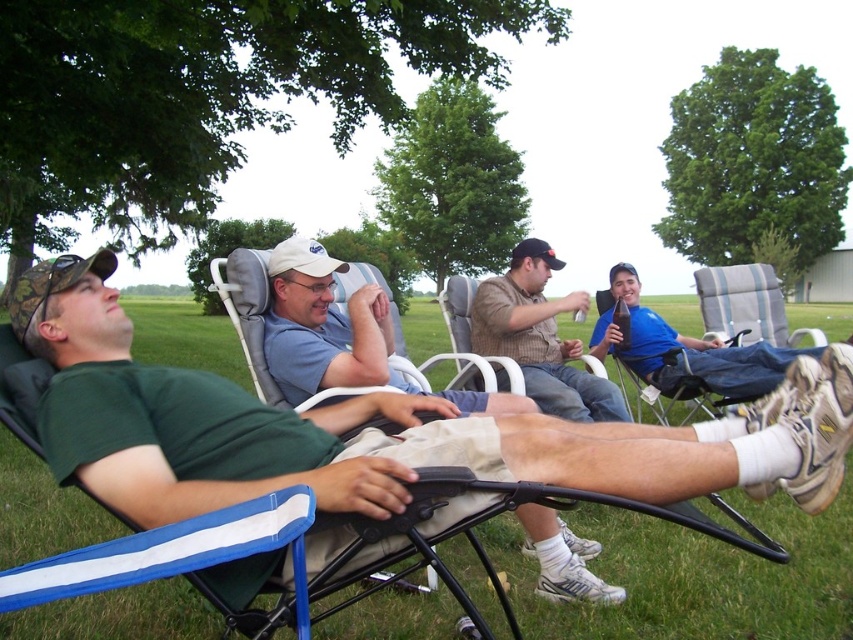
Who is positioned more to the left, light blue fabric chair at center or striped fabric beach chair at right?

light blue fabric chair at center

Consider the image. Who is more forward, (308, 339) or (825, 339)?

Point (308, 339) is in front.

Locate an element on the screen. The width and height of the screenshot is (853, 640). light blue fabric chair at center is located at coordinates (323, 326).

Between green fabric chair at left and light blue fabric chair at center, which one is positioned higher?

light blue fabric chair at center is higher up.

Looking at this image, does green fabric chair at left have a greater height compared to light blue fabric chair at center?

Incorrect, green fabric chair at left's height is not larger of light blue fabric chair at center's.

I want to click on green fabric chair at left, so click(376, 429).

You are a GUI agent. You are given a task and a screenshot of the screen. Output one action in this format:
    pyautogui.click(x=<x>, y=<y>)
    Task: Click on the green fabric chair at left
    
    Given the screenshot: What is the action you would take?
    pyautogui.click(x=376, y=429)

Looking at this image, is green fabric chair at left closer to the viewer compared to striped fabric beach chair at right?

Yes.

Is green fabric chair at left below striped fabric beach chair at right?

Yes, green fabric chair at left is below striped fabric beach chair at right.

Where is `green fabric chair at left`? Image resolution: width=853 pixels, height=640 pixels. green fabric chair at left is located at coordinates (376, 429).

The height and width of the screenshot is (640, 853). Find the location of `green fabric chair at left`. green fabric chair at left is located at coordinates (376, 429).